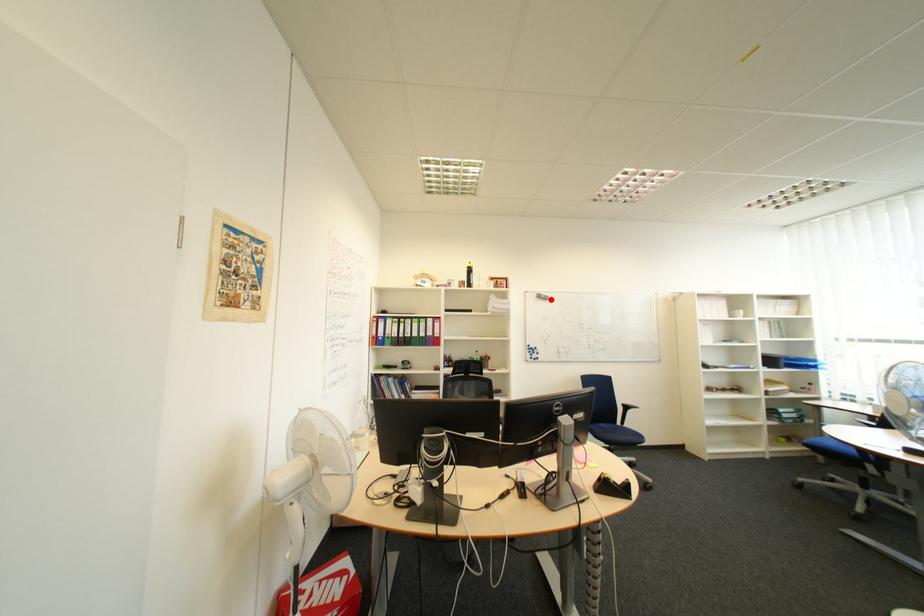
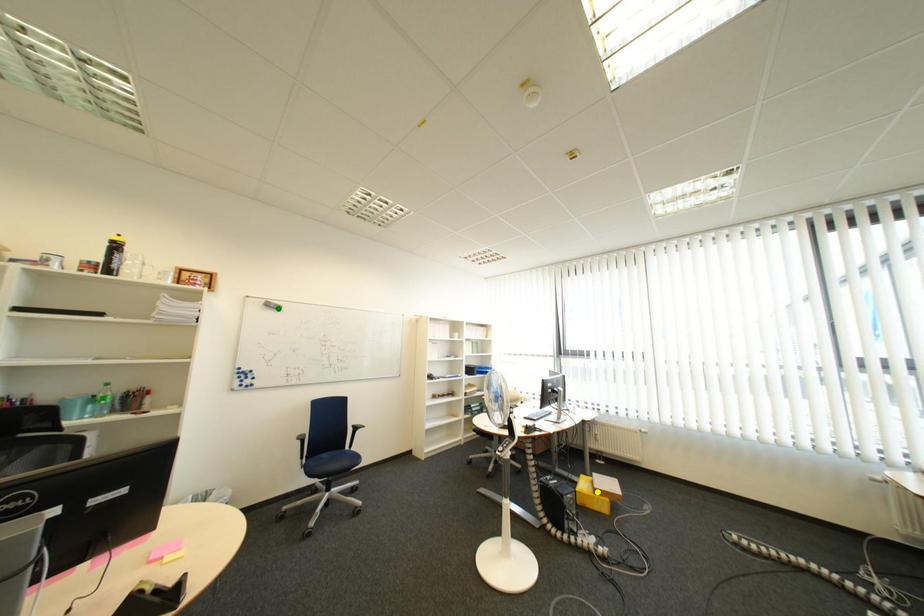
Question: I am providing you with two images of the same scene from different viewpoints. A red point is marked on the first image. You are given multiple points on the second image. Which point in image 2 is actually the same real-world point as the red point in image 1?

Choices:
 (A) green point
 (B) blue point
 (C) yellow point

Answer: (A)